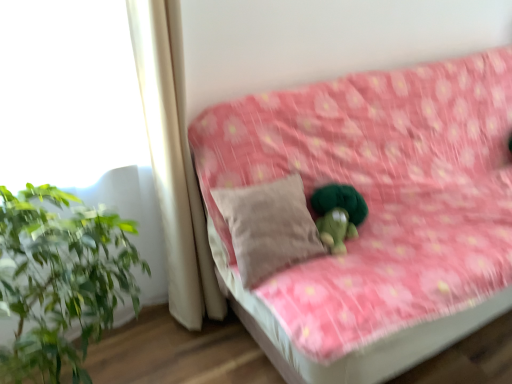
Question: Does pink floral fabric couch at center appear on the right side of white fabric curtain at left?

Choices:
 (A) yes
 (B) no

Answer: (A)

Question: Is pink floral fabric couch at center wider than white fabric curtain at left?

Choices:
 (A) yes
 (B) no

Answer: (A)

Question: Is pink floral fabric couch at center directly adjacent to white fabric curtain at left?

Choices:
 (A) no
 (B) yes

Answer: (A)

Question: Could you tell me if pink floral fabric couch at center is facing white fabric curtain at left?

Choices:
 (A) yes
 (B) no

Answer: (B)

Question: Would you say pink floral fabric couch at center contains white fabric curtain at left?

Choices:
 (A) yes
 (B) no

Answer: (B)

Question: Is the depth of pink floral fabric couch at center less than that of white fabric curtain at left?

Choices:
 (A) yes
 (B) no

Answer: (A)

Question: Is beige fabric pillow at center to the right of pink floral fabric couch at center from the viewer's perspective?

Choices:
 (A) no
 (B) yes

Answer: (A)

Question: Considering the relative positions of beige fabric pillow at center and pink floral fabric couch at center in the image provided, is beige fabric pillow at center in front of pink floral fabric couch at center?

Choices:
 (A) no
 (B) yes

Answer: (A)

Question: Does beige fabric pillow at center come behind pink floral fabric couch at center?

Choices:
 (A) yes
 (B) no

Answer: (A)

Question: Would you say pink floral fabric couch at center is part of beige fabric pillow at center's contents?

Choices:
 (A) no
 (B) yes

Answer: (A)

Question: Does beige fabric pillow at center have a greater width compared to pink floral fabric couch at center?

Choices:
 (A) no
 (B) yes

Answer: (A)

Question: Considering the relative positions of beige fabric pillow at center and pink floral fabric couch at center in the image provided, is beige fabric pillow at center to the left of pink floral fabric couch at center from the viewer's perspective?

Choices:
 (A) no
 (B) yes

Answer: (B)

Question: Considering the relative sizes of white fabric curtain at left and pink floral fabric couch at center in the image provided, is white fabric curtain at left shorter than pink floral fabric couch at center?

Choices:
 (A) yes
 (B) no

Answer: (B)